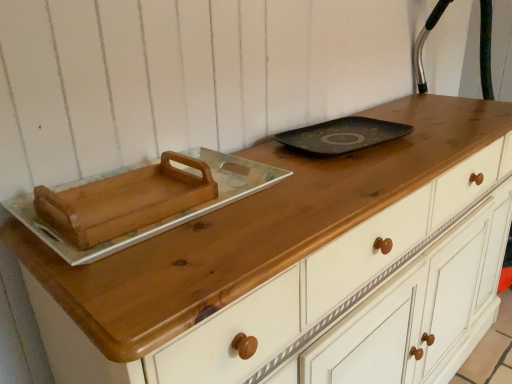
The height and width of the screenshot is (384, 512). Find the location of `free location in front of wooden tray at left`. free location in front of wooden tray at left is located at coordinates (154, 283).